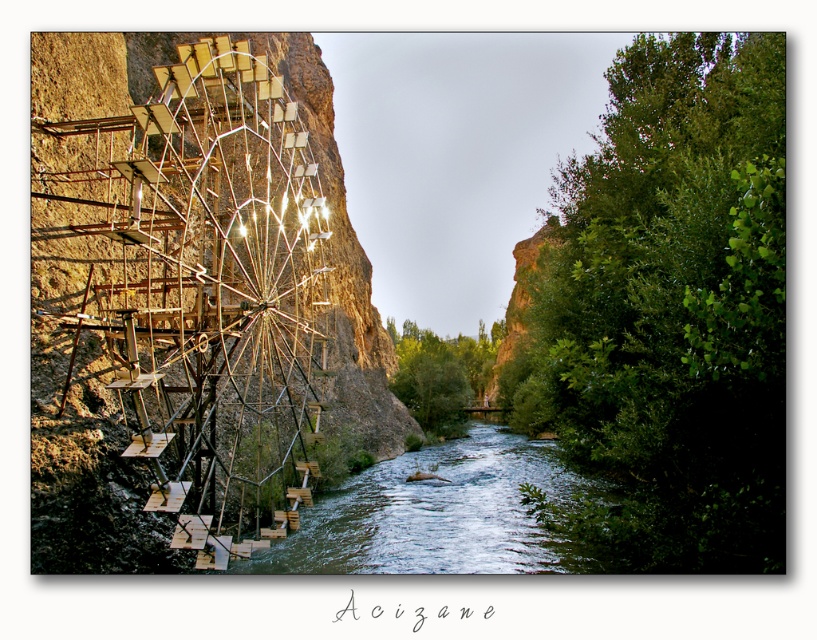
You are standing at the edge of the river and see two points in the scene labeled as point (300, 492) and point (382, 540). If you want to reach both points by walking straight ahead, which point will you encounter first?

You will encounter point (300, 492) first because it is closer to you than point (382, 540), which is further away.

You are standing on a bridge overlooking the river and want to know if the metallic ferris wheel at left can fit entirely within the width of the greenish water at center. Based on the scene, can it?

The metallic ferris wheel at left has a width that is less than the greenish water at center, so yes, it can fit entirely within the width of the greenish water at center.

In the scene shown: You are standing at the center of the river in this serene scene. You want to walk directly towards the metallic ferris wheel at left. Which direction should you head?

You should head to the left since the metallic ferris wheel at left is located at point (199, 282), which is to the left of your current position at the center of the river.